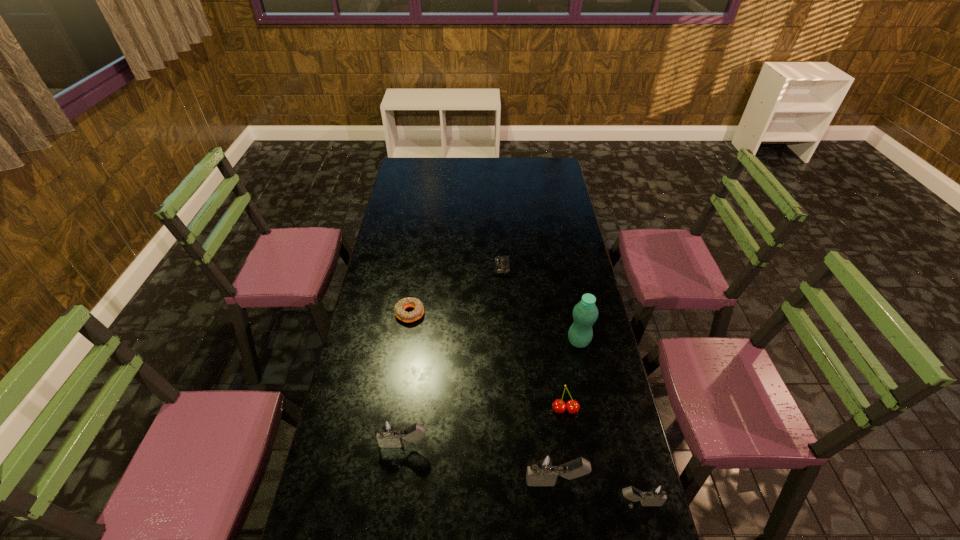
Where is `free space located on the back of the second shortest object`? free space located on the back of the second shortest object is located at coordinates (419, 255).

You are a GUI agent. You are given a task and a screenshot of the screen. Output one action in this format:
    pyautogui.click(x=<x>, y=<y>)
    Task: Click on the blank space located 0.250m with the stems of the cherry pointing upwards
    The height and width of the screenshot is (540, 960).
    Given the screenshot: What is the action you would take?
    pyautogui.click(x=579, y=500)

Find the location of `object that is at the near edge`. object that is at the near edge is located at coordinates (656, 494).

The image size is (960, 540). In order to click on igniter located at the left edge in this screenshot , I will do `click(389, 435)`.

This screenshot has height=540, width=960. Find the location of `doughnut that is at the left edge`. doughnut that is at the left edge is located at coordinates (417, 313).

You are a GUI agent. You are given a task and a screenshot of the screen. Output one action in this format:
    pyautogui.click(x=<x>, y=<y>)
    Task: Click on the water bottle that is at the right edge
    
    Given the screenshot: What is the action you would take?
    pyautogui.click(x=585, y=313)

The height and width of the screenshot is (540, 960). I want to click on cherry at the right edge, so click(559, 406).

At what (x,y) coordinates should I click in order to perform the action: click on object situated at the near right corner. Please return your answer as a coordinate pair (x, y). The height and width of the screenshot is (540, 960). Looking at the image, I should click on (656, 494).

You are a GUI agent. You are given a task and a screenshot of the screen. Output one action in this format:
    pyautogui.click(x=<x>, y=<y>)
    Task: Click on the vacant region at the far edge of the desktop
    Image resolution: width=960 pixels, height=540 pixels.
    Given the screenshot: What is the action you would take?
    pyautogui.click(x=525, y=164)

Image resolution: width=960 pixels, height=540 pixels. In the image, there is a desktop. What are the coordinates of `free space at the near edge` in the screenshot? It's located at 551,504.